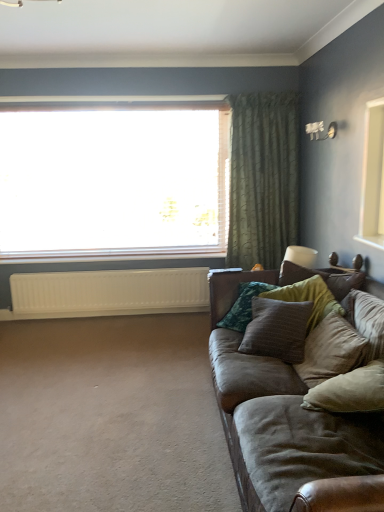
Locate an element on the screen. empty space that is ontop of white matte radiator at lower left (from a real-world perspective) is located at coordinates (80, 271).